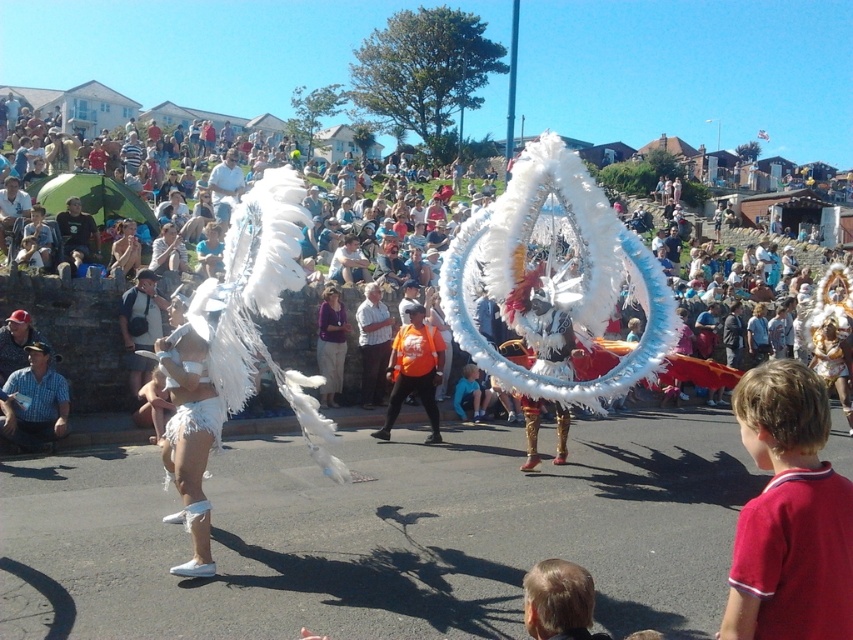
Between orange fabric shirt at center and light blue denim shorts at center, which one has less height?

light blue denim shorts at center

Does orange fabric shirt at center appear on the right side of light blue denim shorts at center?

In fact, orange fabric shirt at center is to the left of light blue denim shorts at center.

Who is more forward, (437, 369) or (474, 365)?

Point (474, 365) is more forward.

At what (x,y) coordinates should I click in order to perform the action: click on orange fabric shirt at center. Please return your answer as a coordinate pair (x, y). Image resolution: width=853 pixels, height=640 pixels. Looking at the image, I should click on (415, 371).

Is point (791, 394) closer to camera compared to point (468, 390)?

Yes, it is.

Does red cotton shirt at lower right have a lesser width compared to light blue denim shorts at center?

No.

Which is in front, point (747, 528) or point (488, 392)?

Point (747, 528) is more forward.

Find the location of a particular element. red cotton shirt at lower right is located at coordinates (788, 515).

Between white fluffy feathers at center and orange fabric shirt at center, which one has less height?

With less height is white fluffy feathers at center.

Does white fluffy feathers at center come behind orange fabric shirt at center?

That is True.

What do you see at coordinates (77, 333) in the screenshot? Image resolution: width=853 pixels, height=640 pixels. I see `white fluffy feathers at center` at bounding box center [77, 333].

Where is `white fluffy feathers at center`? This screenshot has width=853, height=640. white fluffy feathers at center is located at coordinates (77, 333).